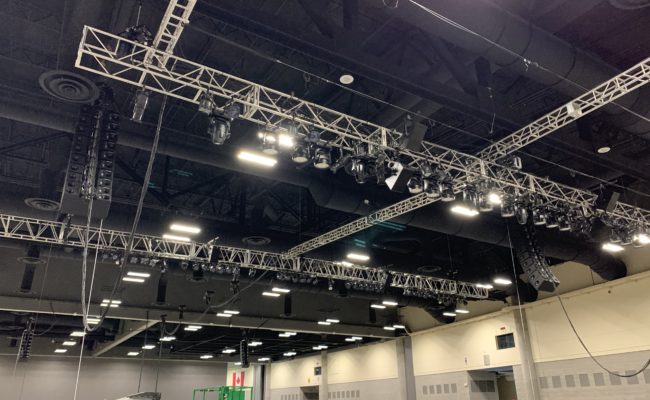
You are a GUI agent. You are given a task and a screenshot of the screen. Output one action in this format:
    pyautogui.click(x=<x>, y=<y>)
    Task: Click on the ladder
    
    Given the screenshot: What is the action you would take?
    pyautogui.click(x=177, y=30)